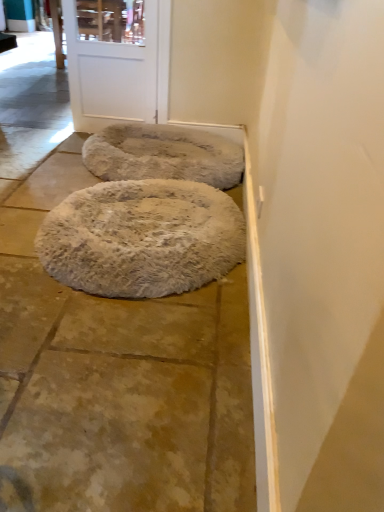
Question: Is white fluffy rug at center inside the boundaries of white fluffy dog bed at center, the second dog bed viewed from the back, or outside?

Choices:
 (A) outside
 (B) inside

Answer: (A)

Question: In terms of size, does white fluffy rug at center appear bigger or smaller than white fluffy dog bed at center, which appears as the 1th dog bed when viewed from the front?

Choices:
 (A) small
 (B) big

Answer: (B)

Question: Estimate the real-world distances between objects in this image. Which object is closer to the white matte door at upper center?

Choices:
 (A) white fluffy dog bed at center, which appears as the 1th dog bed when viewed from the front
 (B) fuzzy beige dog bed at center, the 2th dog bed positioned from the front
 (C) white fluffy rug at center

Answer: (B)

Question: Which object is positioned farthest from the fuzzy beige dog bed at center, placed as the 1th dog bed when sorted from back to front?

Choices:
 (A) white fluffy rug at center
 (B) white matte door at upper center
 (C) white fluffy dog bed at center, which appears as the 1th dog bed when viewed from the front

Answer: (A)